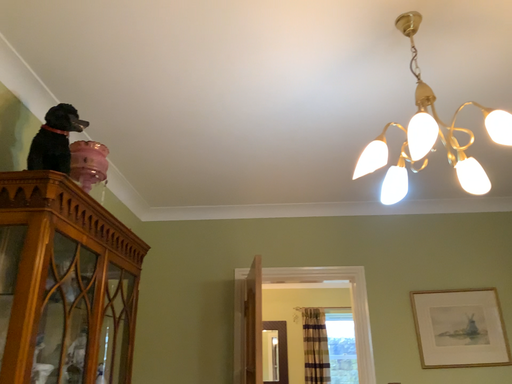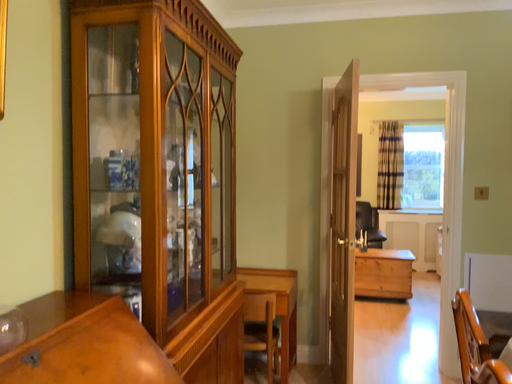
Question: How did the camera likely rotate when shooting the video?

Choices:
 (A) rotated right
 (B) rotated left

Answer: (B)